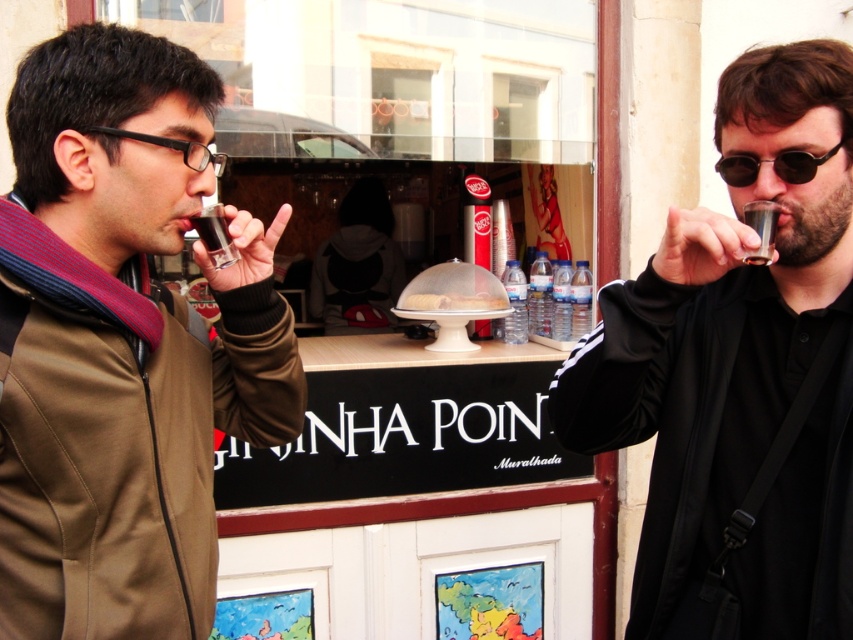
You are at the food stall and want to choose a drink container. The black plastic glasses at left and clear plastic water at center are available. Which one is shorter?

The black plastic glasses at left is not as tall as clear plastic water at center, so the black plastic glasses at left is shorter.